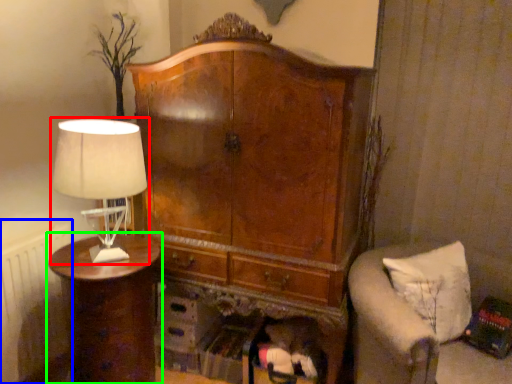
Question: Which object is positioned closest to lamp (highlighted by a red box)? Select from radiator (highlighted by a blue box) and nightstand (highlighted by a green box).

Choices:
 (A) radiator
 (B) nightstand

Answer: (B)